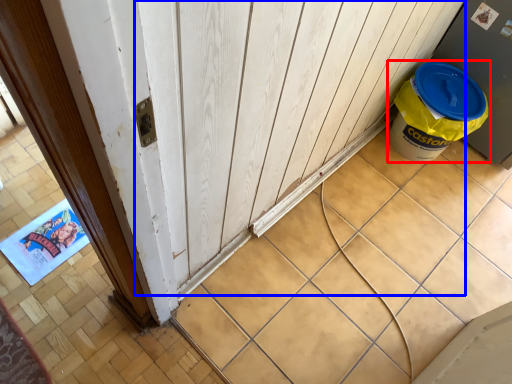
Question: Which object is further to the camera taking this photo, waste container (highlighted by a red box) or barn door (highlighted by a blue box)?

Choices:
 (A) waste container
 (B) barn door

Answer: (A)